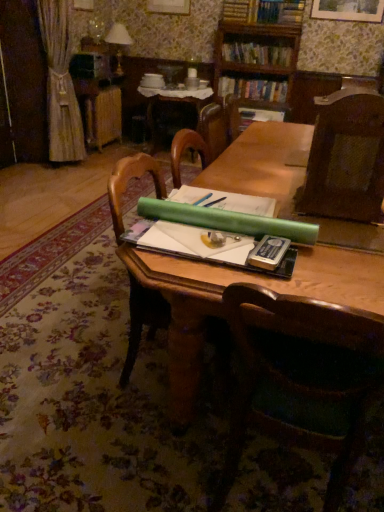
Identify the location of free point to the left of metallic silver paperback book at center. This screenshot has width=384, height=512. (209, 259).